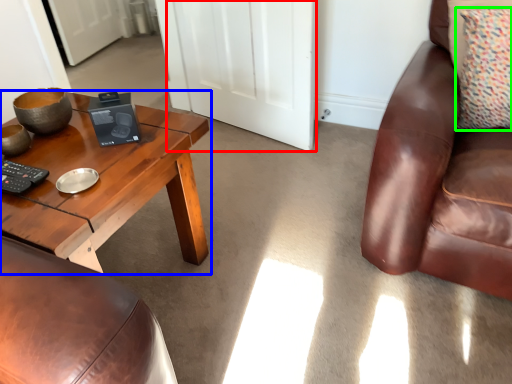
Question: Which is nearer to the door (highlighted by a red box)? coffee table (highlighted by a blue box) or pillow (highlighted by a green box).

Choices:
 (A) coffee table
 (B) pillow

Answer: (A)